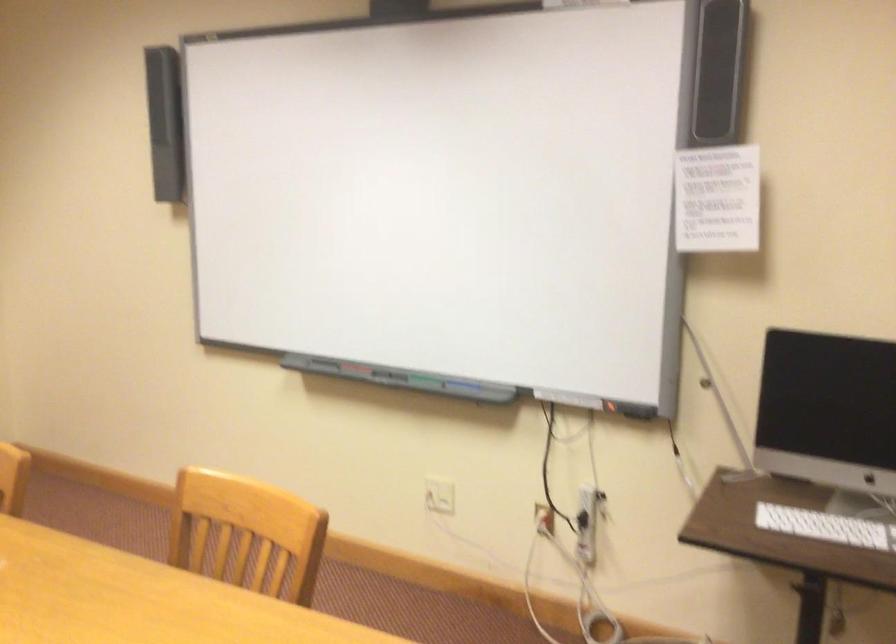
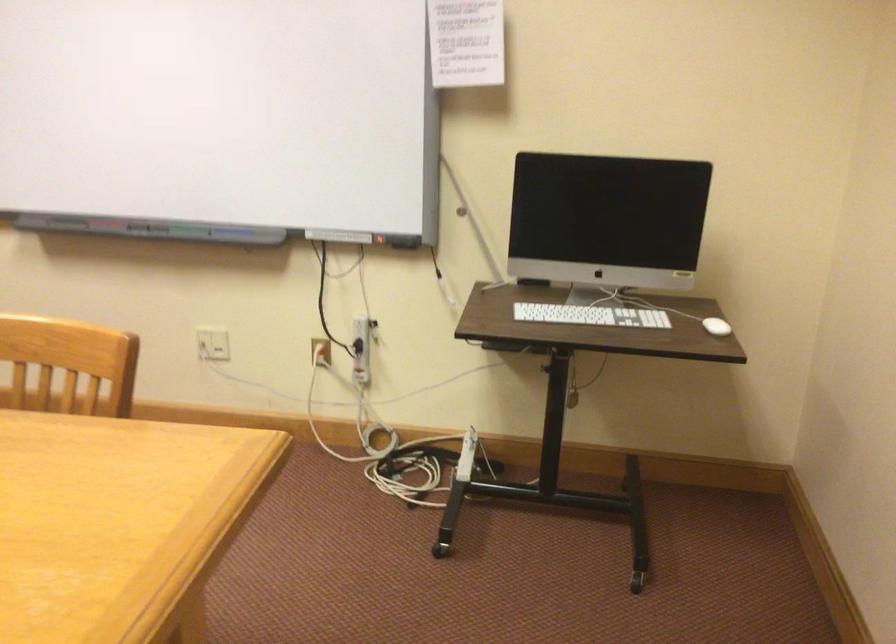
Find the pixel in the second image that matches (350,371) in the first image.

(100, 225)